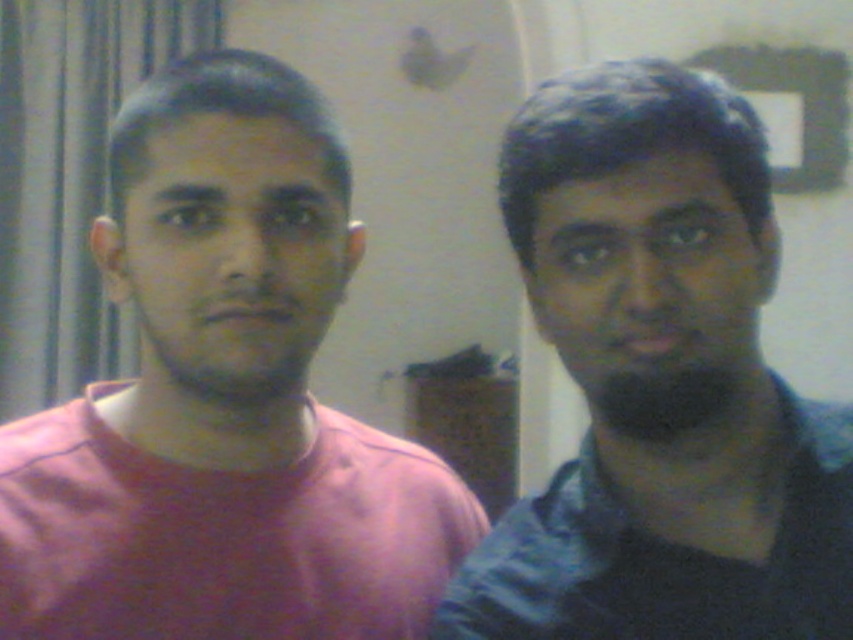
From the picture: Who is shorter, pink matte shirt at left or blue textured shirt at right?

blue textured shirt at right is shorter.

Locate an element on the screen. Image resolution: width=853 pixels, height=640 pixels. pink matte shirt at left is located at coordinates (223, 401).

Locate an element on the screen. Image resolution: width=853 pixels, height=640 pixels. pink matte shirt at left is located at coordinates (223, 401).

Is blue textured shirt at right closer to camera compared to dark matte beard at right?

No, blue textured shirt at right is behind dark matte beard at right.

Which is below, blue textured shirt at right or dark matte beard at right?

Positioned lower is blue textured shirt at right.

Identify the location of blue textured shirt at right. (665, 557).

At what (x,y) coordinates should I click in order to perform the action: click on blue textured shirt at right. Please return your answer as a coordinate pair (x, y). Looking at the image, I should click on (665, 557).

Which of these two, dark blue shirt at right or blue textured shirt at right, stands taller?

Standing taller between the two is dark blue shirt at right.

You are a GUI agent. You are given a task and a screenshot of the screen. Output one action in this format:
    pyautogui.click(x=<x>, y=<y>)
    Task: Click on the dark blue shirt at right
    This screenshot has height=640, width=853.
    Given the screenshot: What is the action you would take?
    660,381